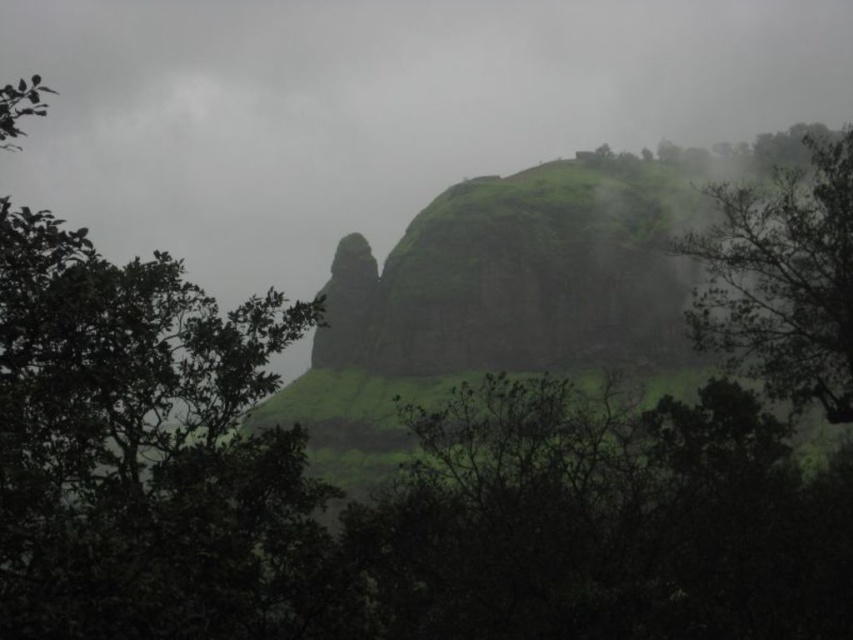
You are an environmental scientist studying the vegetation in this mountainous area. You observe the green leafy tree at center and the green leafy tree at upper right. Which tree would likely have a more developed root system based on their sizes?

The green leafy tree at upper right is larger than the green leafy tree at center, so it likely has a more developed root system to support its size.

You are a photographer standing at the base of the mountain. You want to take a photo that includes both the point at coordinates point (277, 522) and point (728, 252). Which point should you focus on first to ensure both are in sharp focus?

You should focus on point (277, 522) first because it is closer to the camera than point (728, 252). This ensures that both points will be within the depth of field when focused on the closer point.

You are standing at the base of the mountain and see the green leafy tree at center and the green leafy tree at upper right. Which tree is closer to your left side?

The green leafy tree at center is closer to your left side because it is positioned to the left of the green leafy tree at upper right.